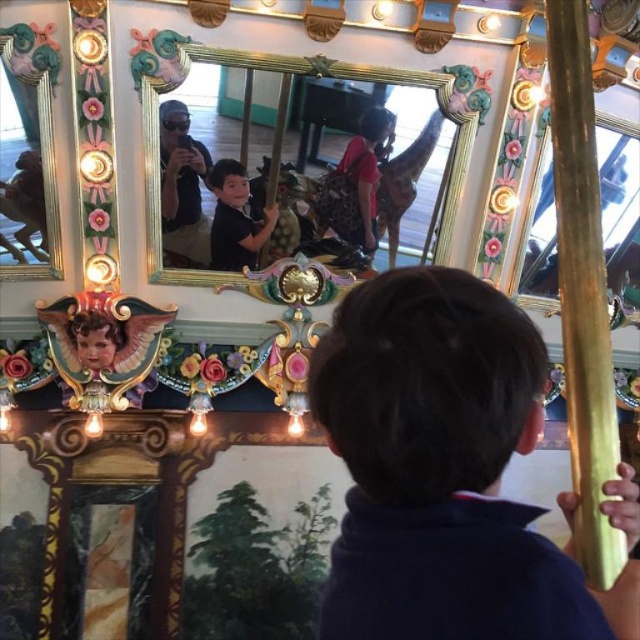
Question: Does matte black shirt at upper left appear on the left side of matte black shirt at center?

Choices:
 (A) yes
 (B) no

Answer: (A)

Question: Which point is closer to the camera?

Choices:
 (A) dark brown hair at center
 (B) matte black shirt at center

Answer: (A)

Question: Does dark brown hair at center appear on the right side of gold/gilded mirror at upper center?

Choices:
 (A) no
 (B) yes

Answer: (B)

Question: Among these objects, which one is farthest from the camera?

Choices:
 (A) matte black shirt at upper left
 (B) gold/gilded mirror at upper center
 (C) gold/gilded frame at upper left
 (D) matte black shirt at center

Answer: (D)

Question: Which point is closer to the camera?

Choices:
 (A) (38, 109)
 (B) (164, 180)
 (C) (227, 262)
 (D) (406, 472)

Answer: (D)

Question: Can you confirm if gold/gilded mirror at upper center is smaller than gold/gilded frame at upper left?

Choices:
 (A) no
 (B) yes

Answer: (B)